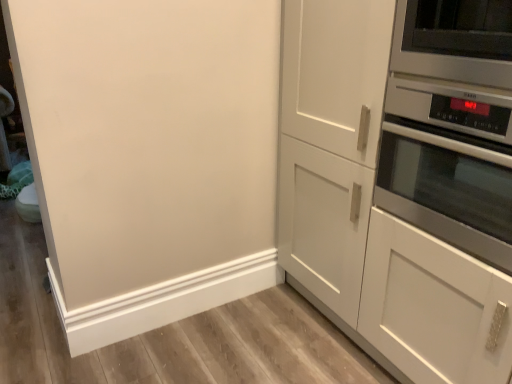
Question: From the image's perspective, is white matte cabinet at right over satin silver microwave at upper right?

Choices:
 (A) yes
 (B) no

Answer: (B)

Question: Is white matte cabinet at right smaller than satin silver microwave at upper right?

Choices:
 (A) yes
 (B) no

Answer: (B)

Question: Is white matte cabinet at right positioned in front of satin silver microwave at upper right?

Choices:
 (A) no
 (B) yes

Answer: (B)

Question: Is white matte cabinet at right outside satin silver microwave at upper right?

Choices:
 (A) no
 (B) yes

Answer: (B)

Question: Could you tell me if white matte cabinet at right is facing satin silver microwave at upper right?

Choices:
 (A) yes
 (B) no

Answer: (B)

Question: From a real-world perspective, relative to white matte cabinet at right, is satin silver microwave at upper right vertically above or below?

Choices:
 (A) below
 (B) above

Answer: (B)

Question: Based on their positions, is satin silver microwave at upper right located to the left or right of white matte cabinet at right?

Choices:
 (A) left
 (B) right

Answer: (B)

Question: Is satin silver microwave at upper right wider or thinner than white matte cabinet at right?

Choices:
 (A) wide
 (B) thin

Answer: (B)

Question: From the image's perspective, is satin silver microwave at upper right positioned above or below white matte cabinet at right?

Choices:
 (A) above
 (B) below

Answer: (A)

Question: From the image's perspective, is stainless steel oven at right located above or below white matte cabinet at right?

Choices:
 (A) above
 (B) below

Answer: (A)

Question: From a real-world perspective, relative to white matte cabinet at right, is stainless steel oven at right vertically above or below?

Choices:
 (A) below
 (B) above

Answer: (B)

Question: Choose the correct answer: Is stainless steel oven at right inside white matte cabinet at right or outside it?

Choices:
 (A) outside
 (B) inside

Answer: (B)

Question: Is point (423, 220) closer or farther from the camera than point (449, 226)?

Choices:
 (A) farther
 (B) closer

Answer: (A)

Question: Does point (437, 57) appear closer or farther from the camera than point (484, 54)?

Choices:
 (A) farther
 (B) closer

Answer: (A)

Question: From a real-world perspective, is stainless steel oven at right positioned above or below satin silver microwave at upper right?

Choices:
 (A) below
 (B) above

Answer: (A)